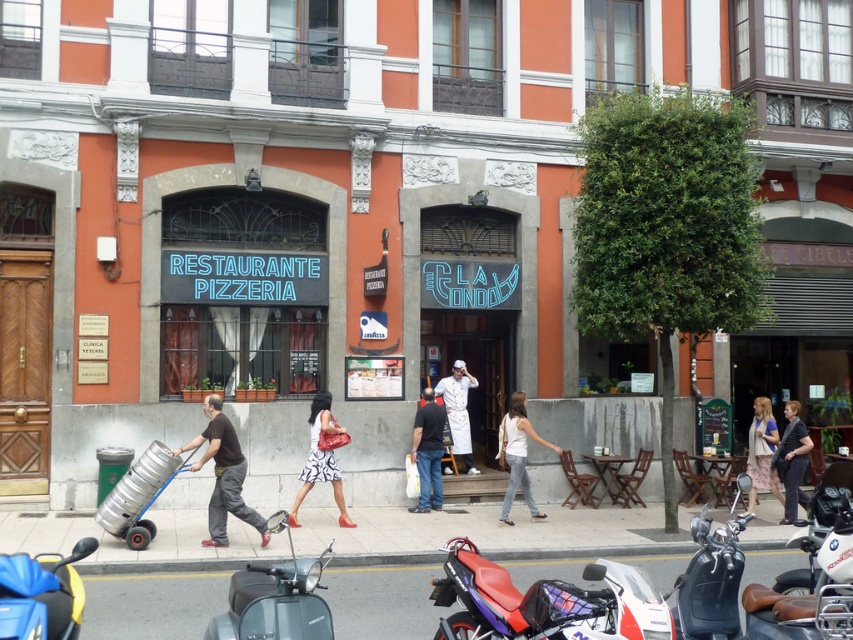
Question: Estimate the real-world distances between objects in this image. Which object is closer to the gray concrete pavement at lower center?

Choices:
 (A) red leather motorcycle at lower center
 (B) brown matte pants at lower left
 (C) white printed dress at center
 (D) dark blue jeans at center

Answer: (D)

Question: Can you confirm if brown matte pants at lower left is smaller than white cotton tank top at center?

Choices:
 (A) yes
 (B) no

Answer: (B)

Question: Does shiny blue motorcycle at lower left appear on the left side of dark gray fabric dress at lower right?

Choices:
 (A) no
 (B) yes

Answer: (B)

Question: Which point is farther to the camera?

Choices:
 (A) white cotton tank top at center
 (B) metallic silver scooter at lower center
 (C) red leather motorcycle at lower center
 (D) brown matte pants at lower left

Answer: (A)

Question: Which of the following is the closest to the observer?

Choices:
 (A) (219, 472)
 (B) (36, 566)

Answer: (B)

Question: Is dark blue jeans at center to the right of white cotton tank top at center from the viewer's perspective?

Choices:
 (A) yes
 (B) no

Answer: (B)